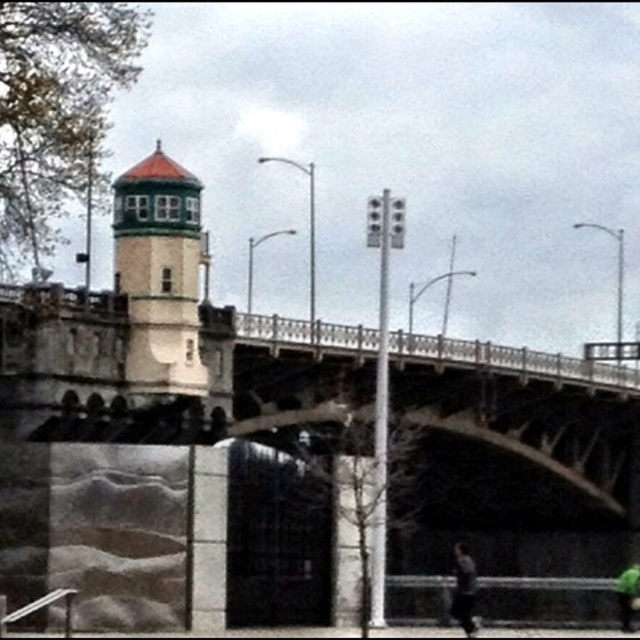
In the scene shown: You are standing on the sidewalk below the bridge and want to locate the point marked at coordinates (160, 275). According to the scene, where exactly would this point be located?

The point marked at coordinates (160, 275) is located on the white painted brick bell tower at upper left.

From the picture: You are a photographer standing on the sidewalk below the bridge. You want to capture a photo of both the dark gray smooth skateboarder at lower right and the green matte skateboard at lower right in the same frame. Which object should you focus on first to ensure both are in focus?

You should focus on the green matte skateboard at lower right first because it is wider than the dark gray smooth skateboarder at lower right, so focusing on the wider object will help ensure both are in focus.

You are standing at point (637, 582) and want to walk to point (147, 388). Based on the scene description, will you be moving towards the bridge or away from it?

You will be moving towards the bridge because point (147, 388) is behind point (637, 582), meaning the bridge is in the direction of point (147, 388).